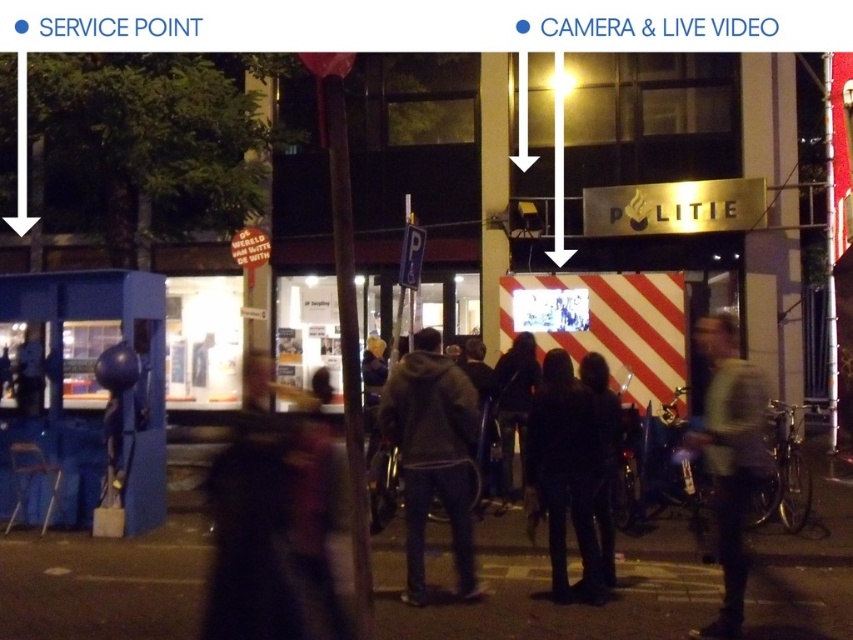
Image resolution: width=853 pixels, height=640 pixels. What do you see at coordinates (432, 454) in the screenshot?
I see `dark gray hoodie at center` at bounding box center [432, 454].

Does dark gray hoodie at center appear on the right side of dark blue jeans at center?

No, dark gray hoodie at center is not to the right of dark blue jeans at center.

Is point (465, 524) more distant than point (585, 387)?

That is False.

The height and width of the screenshot is (640, 853). I want to click on dark gray hoodie at center, so click(432, 454).

Who is lower down, gray fabric jacket at lower right or dark fabric coat at center?

dark fabric coat at center

Who is positioned more to the right, gray fabric jacket at lower right or dark fabric coat at center?

Positioned to the right is gray fabric jacket at lower right.

I want to click on gray fabric jacket at lower right, so click(x=729, y=460).

Can you confirm if dark gray hoodie at center is thinner than gray fabric jacket at lower right?

Incorrect, dark gray hoodie at center's width is not less than gray fabric jacket at lower right's.

Between point (415, 451) and point (712, 422), which one is positioned in front?

Point (712, 422) is in front.

You are a GUI agent. You are given a task and a screenshot of the screen. Output one action in this format:
    pyautogui.click(x=<x>, y=<y>)
    Task: Click on the dark gray hoodie at center
    
    Given the screenshot: What is the action you would take?
    pos(432,454)